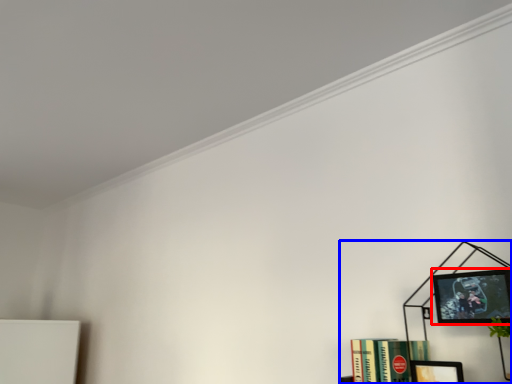
Question: Which object appears farthest to the camera in this image, picture frame (highlighted by a red box) or bookcase (highlighted by a blue box)?

Choices:
 (A) picture frame
 (B) bookcase

Answer: (A)